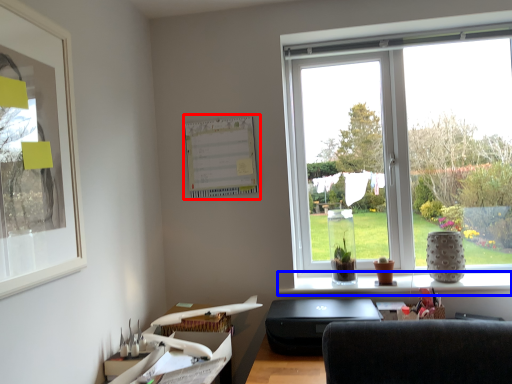
Question: Among these objects, which one is nearest to the camera, bulletin board (highlighted by a red box) or window sill (highlighted by a blue box)?

Choices:
 (A) bulletin board
 (B) window sill

Answer: (B)